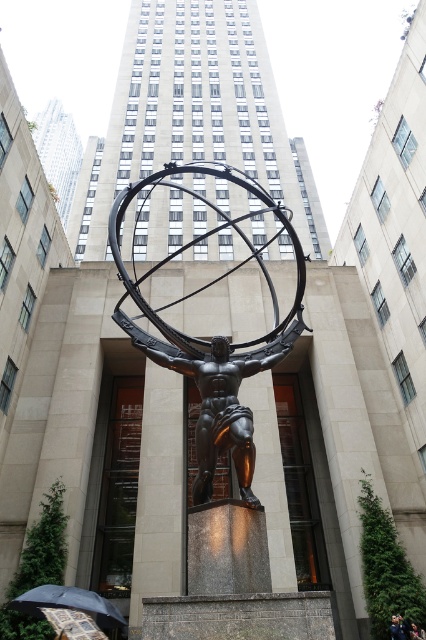
Is bronze statue at center positioned in front of dark blue fabric person at center?

That is True.

Find the location of a particular element. This screenshot has height=640, width=426. bronze statue at center is located at coordinates (213, 342).

Is shiny bronze statue at center to the left of black fabric umbrella at lower left from the viewer's perspective?

No, shiny bronze statue at center is not to the left of black fabric umbrella at lower left.

Between shiny bronze statue at center and black fabric umbrella at lower left, which one is positioned higher?

shiny bronze statue at center is higher up.

Who is more distant from viewer, [253,465] or [117,616]?

The point [117,616] is more distant.

This screenshot has width=426, height=640. Find the location of `shiny bronze statue at center`. shiny bronze statue at center is located at coordinates (219, 412).

From the picture: Can you confirm if shiny bronze statue at center is smaller than dark blue fabric person at center?

Incorrect, shiny bronze statue at center is not smaller in size than dark blue fabric person at center.

Does shiny bronze statue at center have a lesser width compared to dark blue fabric person at center?

No, shiny bronze statue at center is not thinner than dark blue fabric person at center.

Which is behind, point (249, 419) or point (402, 624)?

The point (402, 624) is behind.

Where is `shiny bronze statue at center`? shiny bronze statue at center is located at coordinates (219, 412).